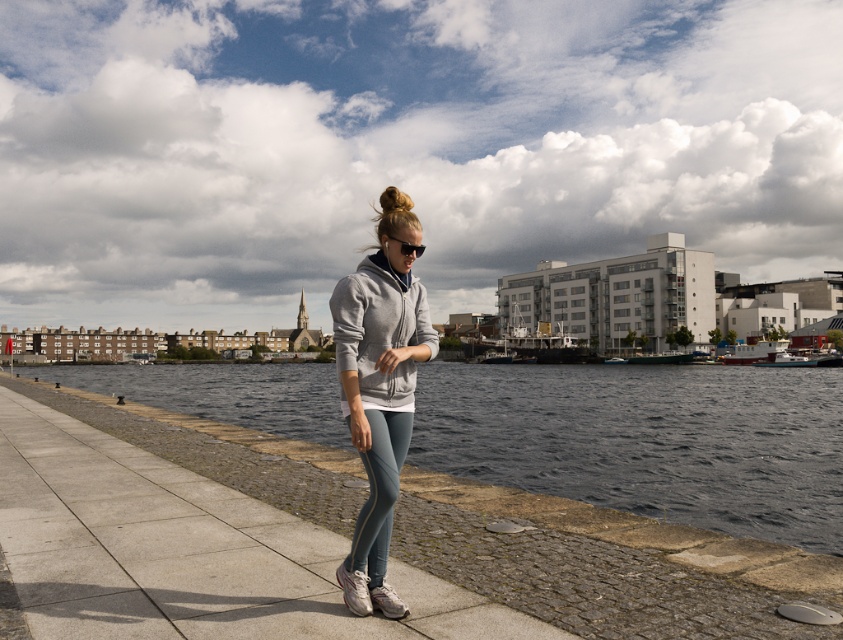
You are standing on the waterfront promenade and want to take a photo of the dark blue water at center. Based on its position, where should you aim your camera to capture it?

The dark blue water at center is located at point 0.689 on the horizontal axis and 0.770 on the vertical axis, so aim your camera towards the lower middle area of the scene to capture it accurately.

You are a photographer trying to capture the woman in the gray fleece sweatshirt at center and the dark blue water at center in the same frame. Based on their positions, which object should you focus on first to ensure both are in the shot?

The dark blue water at center is positioned on the right side of gray fleece sweatshirt at center. To include both in the frame, focus on the gray fleece sweatshirt at center first, then adjust the camera to include the dark blue water at center on its right side.